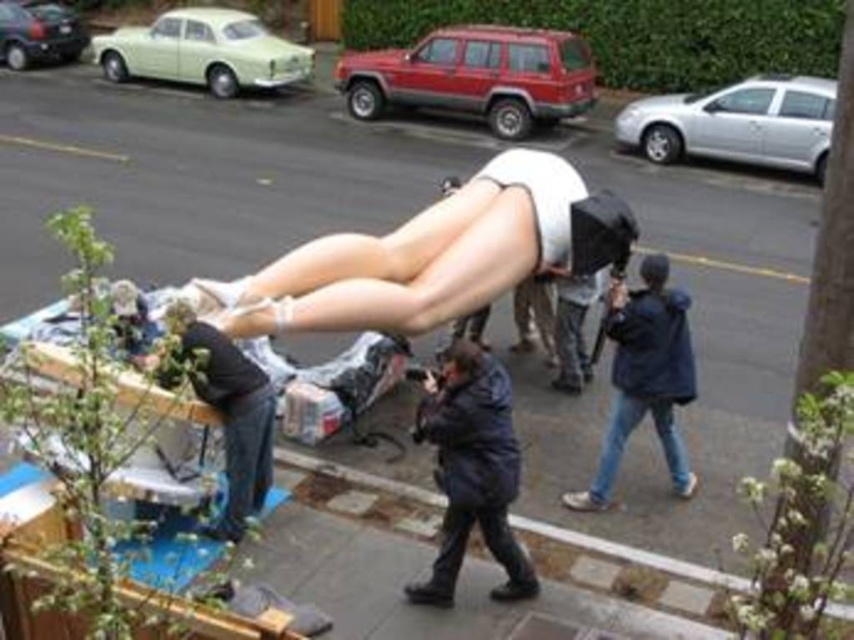
Is dark blue puffy coat at center positioned behind silver metallic car at upper right?

No, dark blue puffy coat at center is closer to the viewer.

Where is `dark blue puffy coat at center`? This screenshot has width=854, height=640. dark blue puffy coat at center is located at coordinates tap(471, 468).

The width and height of the screenshot is (854, 640). What do you see at coordinates (471, 468) in the screenshot? I see `dark blue puffy coat at center` at bounding box center [471, 468].

Locate an element on the screen. Image resolution: width=854 pixels, height=640 pixels. dark blue puffy coat at center is located at coordinates (471, 468).

Locate an element on the screen. This screenshot has width=854, height=640. red matte suv at upper center is located at coordinates (477, 76).

Is the position of red matte suv at upper center more distant than that of blue denim jeans at lower right?

Yes.

Is point (440, 90) positioned in front of point (638, 296)?

That is False.

You are a GUI agent. You are given a task and a screenshot of the screen. Output one action in this format:
    pyautogui.click(x=<x>, y=<y>)
    Task: Click on the red matte suv at upper center
    The width and height of the screenshot is (854, 640).
    Given the screenshot: What is the action you would take?
    click(477, 76)

Who is positioned more to the right, red matte suv at upper center or silver metallic car at upper right?

Positioned to the right is silver metallic car at upper right.

From the picture: Does red matte suv at upper center appear on the right side of silver metallic car at upper right?

In fact, red matte suv at upper center is to the left of silver metallic car at upper right.

Identify the location of red matte suv at upper center. This screenshot has width=854, height=640. (477, 76).